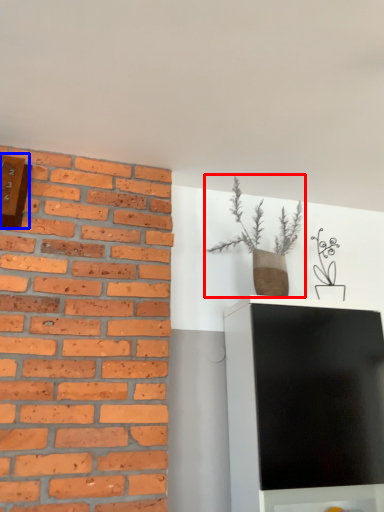
Question: Which object appears farthest to the camera in this image, houseplant (highlighted by a red box) or clock (highlighted by a blue box)?

Choices:
 (A) houseplant
 (B) clock

Answer: (A)